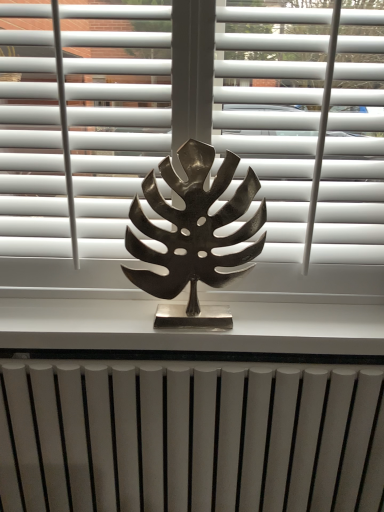
Question: Considering their positions, is metallic silver leaf at center located in front of or behind white matte blind at upper center?

Choices:
 (A) behind
 (B) front

Answer: (A)

Question: From a real-world perspective, relative to white matte blind at upper center, is metallic silver leaf at center vertically above or below?

Choices:
 (A) below
 (B) above

Answer: (A)

Question: Considering the real-world distances, which object is closest to the bronze leaf at center?

Choices:
 (A) metallic silver leaf at center
 (B) metallic silver at center
 (C) white matte radiator at bottom
 (D) white matte blind at upper center

Answer: (A)

Question: Which is nearer to the metallic silver at center?

Choices:
 (A) metallic silver leaf at center
 (B) bronze leaf at center
 (C) white matte blind at upper center
 (D) white matte radiator at bottom

Answer: (D)